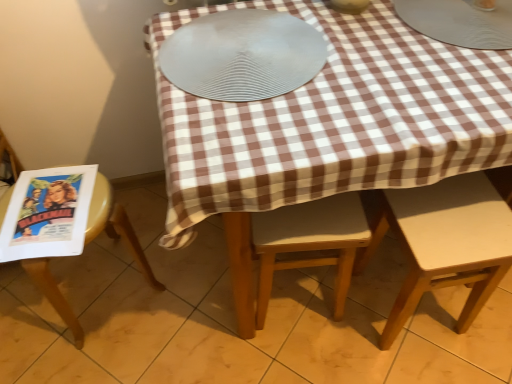
This screenshot has width=512, height=384. I want to click on vacant region in front of light brown wooden chair at center, arranged as the second chair when viewed from the right, so click(306, 355).